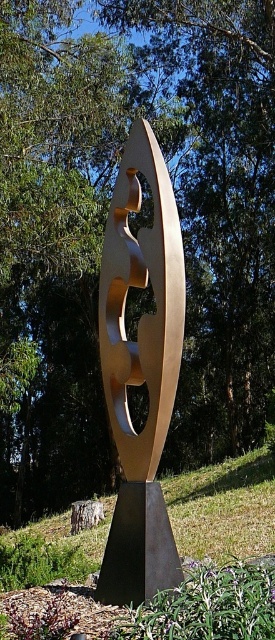
Question: Which object is closer to the camera taking this photo?

Choices:
 (A) gold polished sculpture at center
 (B) gold polished metal abstract art at center

Answer: (A)

Question: Is gold polished metal abstract art at center positioned in front of gold polished sculpture at center?

Choices:
 (A) no
 (B) yes

Answer: (A)

Question: In this image, where is gold polished metal abstract art at center located relative to gold polished sculpture at center?

Choices:
 (A) left
 (B) right

Answer: (A)

Question: Can you confirm if gold polished metal abstract art at center is thinner than gold polished sculpture at center?

Choices:
 (A) yes
 (B) no

Answer: (A)

Question: Which point is farther to the camera?

Choices:
 (A) gold polished sculpture at center
 (B) gold polished metal abstract art at center

Answer: (B)